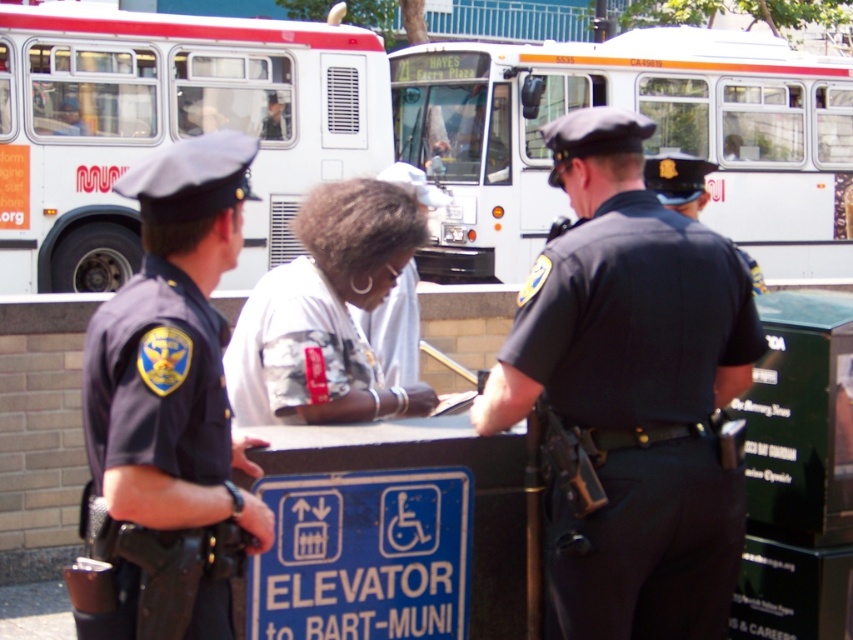
Question: Is dark blue uniform at center above white fabric shirt at center?

Choices:
 (A) no
 (B) yes

Answer: (A)

Question: Which is farther from the white fabric shirt at center?

Choices:
 (A) white matte bus at center
 (B) dark blue uniform at center
 (C) white matte bus at upper left

Answer: (A)

Question: Which of the following is the farthest from the observer?

Choices:
 (A) white fabric shirt at center
 (B) white matte bus at center
 (C) dark blue uniform at left
 (D) dark blue uniform at center

Answer: (B)

Question: Is dark blue uniform at center wider than white matte bus at center?

Choices:
 (A) no
 (B) yes

Answer: (B)

Question: Among these objects, which one is nearest to the camera?

Choices:
 (A) white fabric shirt at center
 (B) white matte bus at upper left
 (C) white matte bus at center

Answer: (A)

Question: Is dark blue uniform at center thinner than dark blue uniform at left?

Choices:
 (A) no
 (B) yes

Answer: (A)